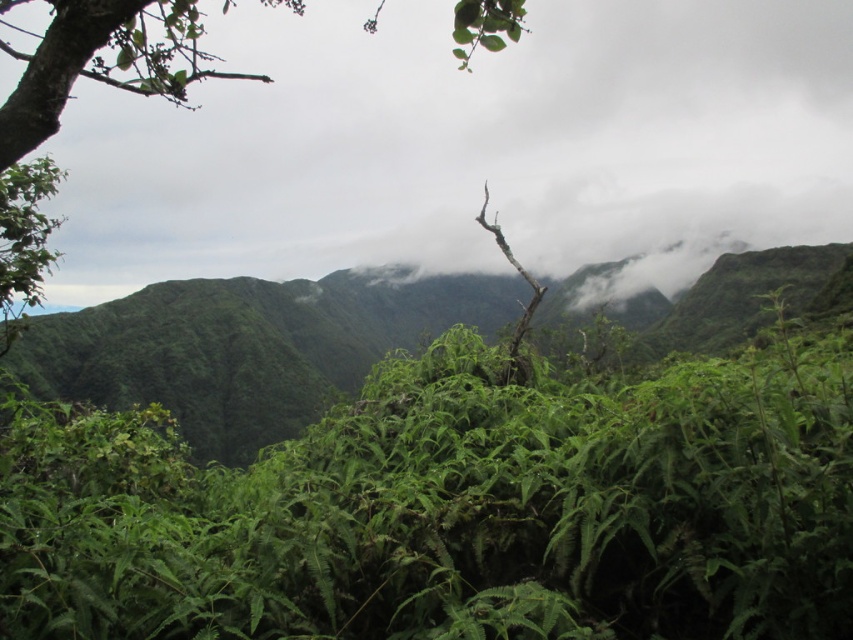
Between green leafy shrubs at center and green leafy tree at upper center, which one is positioned lower?

green leafy shrubs at center is below.

Can you confirm if green leafy shrubs at center is bigger than green leafy tree at upper center?

No, green leafy shrubs at center is not bigger than green leafy tree at upper center.

Is point (595, 598) farther from viewer compared to point (138, 17)?

Yes, it is behind point (138, 17).

What are the coordinates of `green leafy shrubs at center` in the screenshot? It's located at (451, 508).